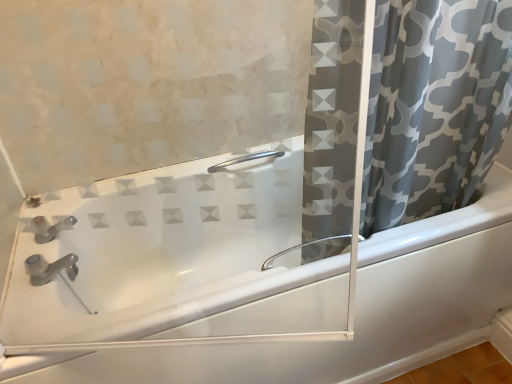
The image size is (512, 384). I want to click on free space in front of satin nickel faucet at upper left, so click(x=40, y=320).